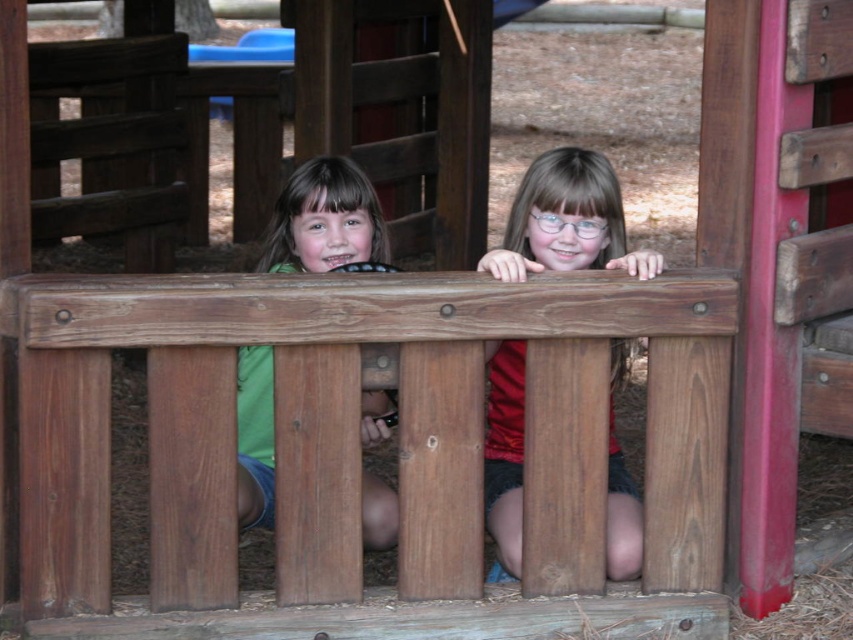
Does matte red shirt at center appear on the left side of green matte shirt at center?

In fact, matte red shirt at center is to the right of green matte shirt at center.

Can you confirm if matte red shirt at center is taller than green matte shirt at center?

Correct, matte red shirt at center is much taller as green matte shirt at center.

Describe the element at coordinates (567, 220) in the screenshot. This screenshot has width=853, height=640. I see `matte red shirt at center` at that location.

This screenshot has height=640, width=853. What are the coordinates of `matte red shirt at center` in the screenshot? It's located at pos(567,220).

Which is below, green matte shirt at center or blue plastic slide at upper center?

green matte shirt at center

Can you confirm if green matte shirt at center is positioned to the left of blue plastic slide at upper center?

No, green matte shirt at center is not to the left of blue plastic slide at upper center.

What are the coordinates of `green matte shirt at center` in the screenshot? It's located at (323, 220).

Is matte red shirt at center above blue plastic slide at upper center?

No.

Is point (567, 170) closer to camera compared to point (239, 45)?

Yes, point (567, 170) is closer to viewer.

Image resolution: width=853 pixels, height=640 pixels. I want to click on matte red shirt at center, so click(x=567, y=220).